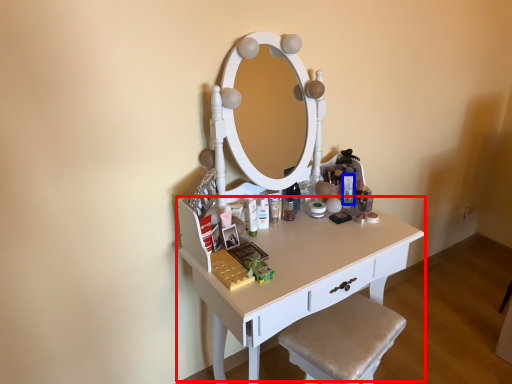
Question: Which point is further to the camera, table (highlighted by a red box) or toiletry (highlighted by a blue box)?

Choices:
 (A) table
 (B) toiletry

Answer: (B)